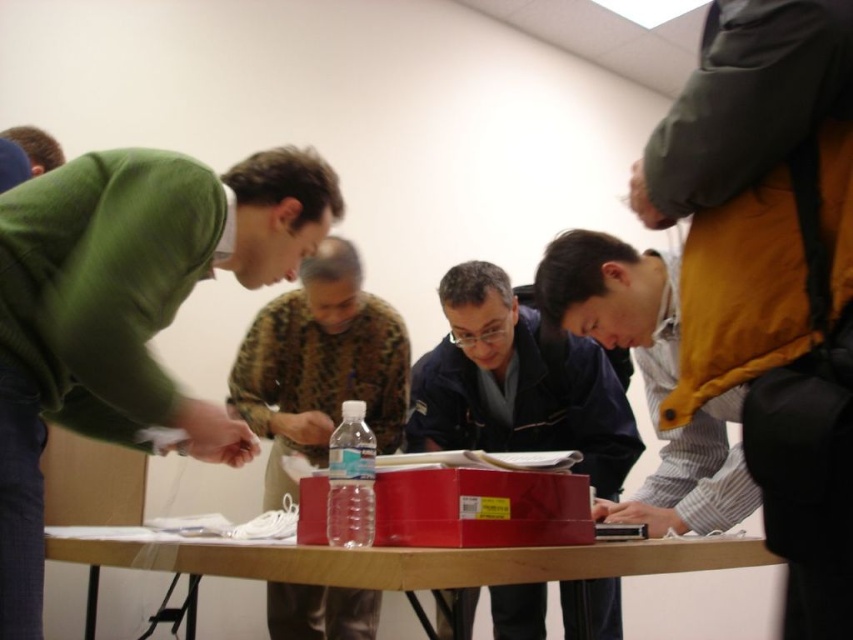
You are a tailor measuring the distance between two buttons on a green matte sweater at left. The buttons are 38.60 inches apart. Can you sew a third button exactly halfway between them?

The buttons on the green matte sweater at left are 38.60 inches apart, so placing a third button halfway would require measuring 19.30 inches from each existing button.

In the scene described, two people are wearing the matte black jacket at center and the camouflage fabric shirt at center. Based on their positions, which clothing item is positioned to the right of the other?

The matte black jacket at center is to the right of the camouflage fabric shirt at center.